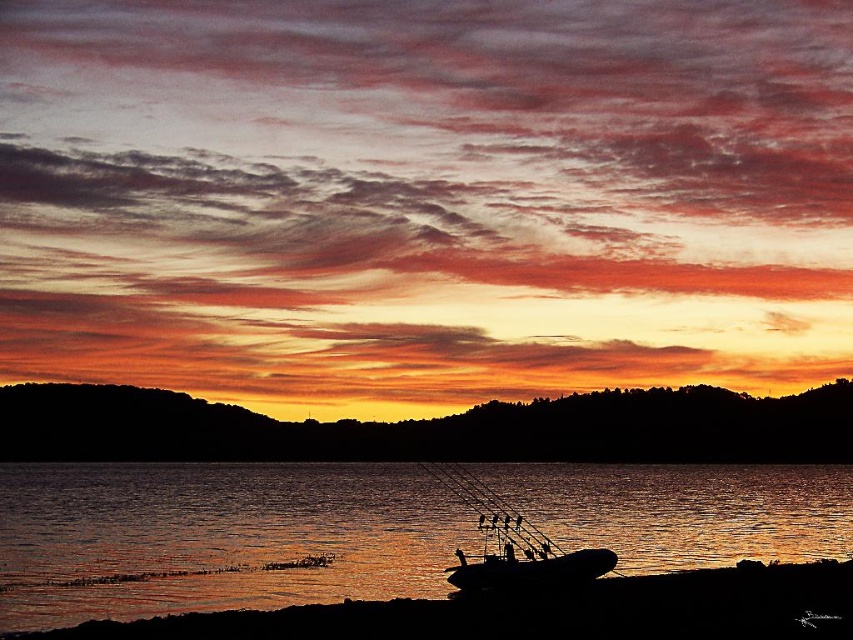
Is smooth sand at lower center behind silhouette rubber boat at center?

No.

What do you see at coordinates (544, 611) in the screenshot? I see `smooth sand at lower center` at bounding box center [544, 611].

The width and height of the screenshot is (853, 640). I want to click on smooth sand at lower center, so click(544, 611).

What do you see at coordinates (213, 536) in the screenshot? Image resolution: width=853 pixels, height=640 pixels. I see `glistening water at lower center` at bounding box center [213, 536].

Who is more distant from viewer, [724,493] or [601,552]?

The point [724,493] is more distant.

What are the coordinates of `glistening water at lower center` in the screenshot? It's located at (213, 536).

Locate an element on the screen. silhouette rubber boat at center is located at coordinates (511, 545).

Image resolution: width=853 pixels, height=640 pixels. I want to click on silhouette rubber boat at center, so click(x=511, y=545).